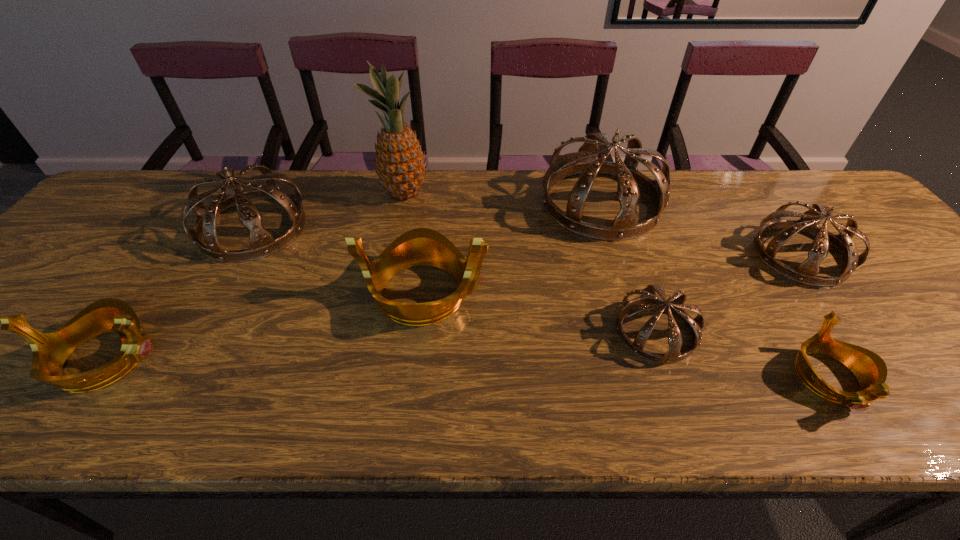
The image size is (960, 540). In order to click on the tallest object in this screenshot , I will do `click(400, 165)`.

Find the location of `the second tallest object`. the second tallest object is located at coordinates (625, 226).

Find the location of a particular element. the tallest tiara is located at coordinates (625, 226).

Where is `the leftmost brown tiara`? This screenshot has height=540, width=960. the leftmost brown tiara is located at coordinates (262, 243).

Locate an element on the screen. Image resolution: width=960 pixels, height=540 pixels. the third tiara from left to right is located at coordinates (422, 246).

Find the location of a particular element. The width and height of the screenshot is (960, 540). the biggest gold tiara is located at coordinates (422, 246).

Image resolution: width=960 pixels, height=540 pixels. Find the location of `the third biggest brown tiara`. the third biggest brown tiara is located at coordinates point(805,273).

Where is `the second smallest gold tiara`? The width and height of the screenshot is (960, 540). the second smallest gold tiara is located at coordinates (50, 350).

The image size is (960, 540). Identify the location of the nearest brown tiara. (648, 300).

You are a GUI agent. You are given a task and a screenshot of the screen. Output one action in this format:
    pyautogui.click(x=<x>, y=<y>)
    Task: Click on the shortest tiara
    This screenshot has height=540, width=960.
    Given the screenshot: What is the action you would take?
    pyautogui.click(x=869, y=368)